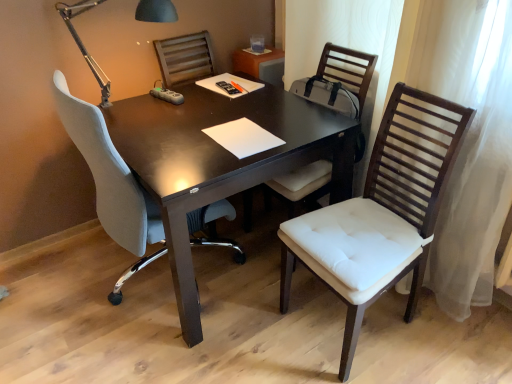
What are the coordinates of `free space to the back side of white paper at center` in the screenshot? It's located at click(246, 107).